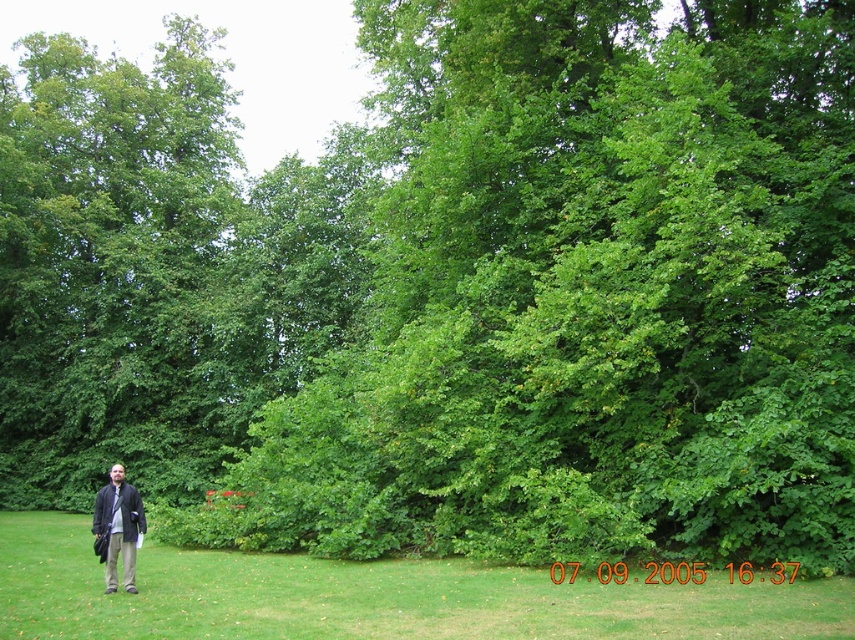
You are standing in the forest and want to take a photo of the green grass at left and the dark gray wool coat at lower left. Which object is wider in the image?

The green grass at left is wider than the dark gray wool coat at lower left.

You are a photographer trying to capture a clear shot of the green grass at left. However, the dark gray wool coat at lower left is blocking your view. Can you move the coat to the side to get an unobstructed view of the grass?

The green grass at left is positioned under the dark gray wool coat at lower left, so moving the coat to the side would allow you to see the grass without obstruction.

Consider the image. You are a photographer trying to capture a clear shot of the green grass at left. However, the dark gray wool coat at lower left is blocking your view. Can you determine which object is taller to decide if you need to move closer or adjust your angle?

The green grass at left is not as tall as the dark gray wool coat at lower left, so the dark gray wool coat at lower left is taller. To capture the green grass at left without obstruction, you should adjust your angle or move closer to ensure the shorter grass is visible.